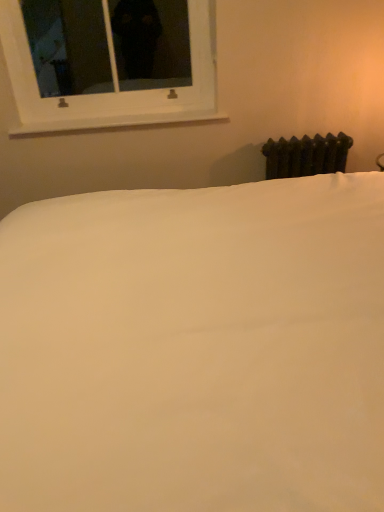
At what (x,y) coordinates should I click in order to perform the action: click on white plastic window at upper left. Please return your answer as a coordinate pair (x, y). The image size is (384, 512). Looking at the image, I should click on (114, 83).

Image resolution: width=384 pixels, height=512 pixels. Describe the element at coordinates (114, 83) in the screenshot. I see `white plastic window at upper left` at that location.

Measure the distance between point [213,118] and camera.

7.14 feet.

Where is `dark green cast iron radiator at right`? dark green cast iron radiator at right is located at coordinates (306, 155).

Consider the image. Considering the relative positions of white smooth bed at center and white smooth window sill at upper center in the image provided, is white smooth bed at center to the right of white smooth window sill at upper center from the viewer's perspective?

Yes.

Is white smooth bed at center positioned beyond the bounds of white smooth window sill at upper center?

Indeed, white smooth bed at center is completely outside white smooth window sill at upper center.

Considering the positions of objects white smooth bed at center and white smooth window sill at upper center in the image provided, who is behind, white smooth bed at center or white smooth window sill at upper center?

white smooth window sill at upper center is behind.

Find the location of a particular element. This screenshot has width=384, height=512. bed on the right of white smooth window sill at upper center is located at coordinates (195, 348).

Is the depth of dark green cast iron radiator at right greater than that of white smooth window sill at upper center?

Yes, dark green cast iron radiator at right is further from the camera.

From a real-world perspective, relative to white smooth window sill at upper center, is dark green cast iron radiator at right vertically above or below?

Clearly, from a real-world perspective, dark green cast iron radiator at right is below white smooth window sill at upper center.

Between dark green cast iron radiator at right and white smooth window sill at upper center, which one has smaller size?

Smaller between the two is white smooth window sill at upper center.

Is dark green cast iron radiator at right facing away from white smooth window sill at upper center?

No, white smooth window sill at upper center is not at the back of dark green cast iron radiator at right.

Considering their positions, is dark green cast iron radiator at right located in front of or behind white smooth bed at center?

Visually, dark green cast iron radiator at right is located behind white smooth bed at center.

Which of these two, dark green cast iron radiator at right or white smooth bed at center, is thinner?

With smaller width is dark green cast iron radiator at right.

Are dark green cast iron radiator at right and white smooth bed at center far apart?

Yes, dark green cast iron radiator at right and white smooth bed at center are located far from each other.

Does point (340, 151) lie in front of point (131, 367)?

No, (340, 151) is further to viewer.

In order to click on window sill on the left of white smooth bed at center in this screenshot , I will do `click(115, 123)`.

Considering the sizes of objects white smooth window sill at upper center and white smooth bed at center in the image provided, who is thinner, white smooth window sill at upper center or white smooth bed at center?

white smooth window sill at upper center is thinner.

Does white smooth window sill at upper center contain white smooth bed at center?

No, white smooth bed at center is not surrounded by white smooth window sill at upper center.

Is white smooth window sill at upper center in front of or behind white smooth bed at center in the image?

white smooth window sill at upper center is positioned farther from the viewer than white smooth bed at center.

Is white plastic window at upper left not inside dark green cast iron radiator at right?

Yes, white plastic window at upper left is located beyond the bounds of dark green cast iron radiator at right.

Which point is more distant from viewer, (43, 129) or (349, 142)?

The point (349, 142) is behind.

Consider the image. From a real-world perspective, which object rests below the other?

dark green cast iron radiator at right is physically lower.

Who is more distant, white plastic window at upper left or dark green cast iron radiator at right?

dark green cast iron radiator at right is further from the camera.

Is the position of white plastic window at upper left more distant than that of white smooth window sill at upper center?

No, white plastic window at upper left is closer to the viewer.

From a real-world perspective, which object rests below the other?

From a 3D spatial view, white smooth window sill at upper center is below.

Between white plastic window at upper left and white smooth window sill at upper center, which one has less height?

white smooth window sill at upper center.

Considering the points (179, 110) and (100, 128), which point is behind, point (179, 110) or point (100, 128)?

The point (179, 110) is farther.

Considering the positions of points (283, 161) and (95, 102), is point (283, 161) farther from camera compared to point (95, 102)?

Yes, point (283, 161) is behind point (95, 102).

Is dark green cast iron radiator at right facing towards white plastic window at upper left?

No.

In terms of size, does dark green cast iron radiator at right appear bigger or smaller than white plastic window at upper left?

Clearly, dark green cast iron radiator at right is smaller in size than white plastic window at upper left.

This screenshot has height=512, width=384. In the image, there is a white smooth window sill at upper center. Identify the location of bed below it (from a real-world perspective). (195, 348).

Image resolution: width=384 pixels, height=512 pixels. Identify the location of radiator on the right of white smooth window sill at upper center. (306, 155).

From the image, which object appears to be nearer to dark green cast iron radiator at right, white plastic window at upper left or white smooth window sill at upper center?

The object closer to dark green cast iron radiator at right is white smooth window sill at upper center.

Estimate the real-world distances between objects in this image. Which object is closer to white plastic window at upper left, dark green cast iron radiator at right or white smooth window sill at upper center?

Based on the image, white smooth window sill at upper center appears to be nearer to white plastic window at upper left.

Estimate the real-world distances between objects in this image. Which object is closer to white smooth bed at center, white plastic window at upper left or white smooth window sill at upper center?

Based on the image, white plastic window at upper left appears to be nearer to white smooth bed at center.

Looking at the image, which one is located further to white plastic window at upper left, white smooth bed at center or dark green cast iron radiator at right?

white smooth bed at center is positioned further to the anchor white plastic window at upper left.

Based on their spatial positions, is white smooth bed at center or white smooth window sill at upper center closer to dark green cast iron radiator at right?

white smooth window sill at upper center is positioned closer to the anchor dark green cast iron radiator at right.

Looking at the image, which one is located closer to white smooth bed at center, dark green cast iron radiator at right or white smooth window sill at upper center?

Among the two, dark green cast iron radiator at right is located nearer to white smooth bed at center.

Considering their positions, is dark green cast iron radiator at right positioned closer to white smooth window sill at upper center than white plastic window at upper left?

Among the two, white plastic window at upper left is located nearer to white smooth window sill at upper center.

From the image, which object appears to be farther from white plastic window at upper left, white smooth window sill at upper center or dark green cast iron radiator at right?

Among the two, dark green cast iron radiator at right is located further to white plastic window at upper left.

Where is `window between white smooth bed at center and dark green cast iron radiator at right along the z-axis`? Image resolution: width=384 pixels, height=512 pixels. window between white smooth bed at center and dark green cast iron radiator at right along the z-axis is located at coordinates (114, 83).

Locate an element on the screen. The height and width of the screenshot is (512, 384). window sill between white plastic window at upper left and dark green cast iron radiator at right is located at coordinates (115, 123).

Locate an element on the screen. window sill between white smooth bed at center and dark green cast iron radiator at right from front to back is located at coordinates (115, 123).

Find the location of a particular element. window positioned between white smooth bed at center and white smooth window sill at upper center from near to far is located at coordinates (114, 83).